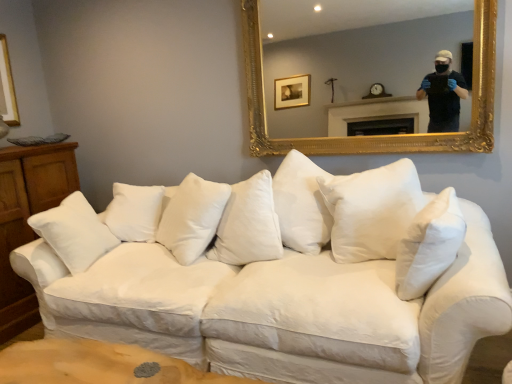
Question: Would you say white soft pillow at center, which appears as the first pillow when viewed from the right, is to the left or to the right of wooden dresser at left in the picture?

Choices:
 (A) left
 (B) right

Answer: (B)

Question: Relative to wooden dresser at left, is white soft pillow at center, which appears as the first pillow when viewed from the right, in front or behind?

Choices:
 (A) front
 (B) behind

Answer: (A)

Question: Estimate the real-world distances between objects in this image. Which object is farther from the gold ornate mirror at upper center?

Choices:
 (A) white cotton couch at center
 (B) white cotton pillow at center, the 1th pillow positioned from the back
 (C) white soft pillow at center, which is the first pillow from front to back
 (D) wooden dresser at left

Answer: (C)

Question: Which object is the closest to the white cotton pillow at center, the 2th pillow viewed from the right?

Choices:
 (A) gold ornate mirror at upper center
 (B) white cotton couch at center
 (C) wooden dresser at left
 (D) white soft pillow at center, which is the first pillow from front to back

Answer: (B)